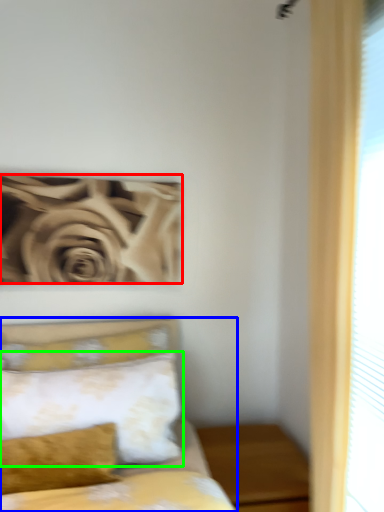
Question: Based on their relative distances, which object is farther from rose (highlighted by a red box)? Choose from bed (highlighted by a blue box) and pillow (highlighted by a green box).

Choices:
 (A) bed
 (B) pillow

Answer: (B)